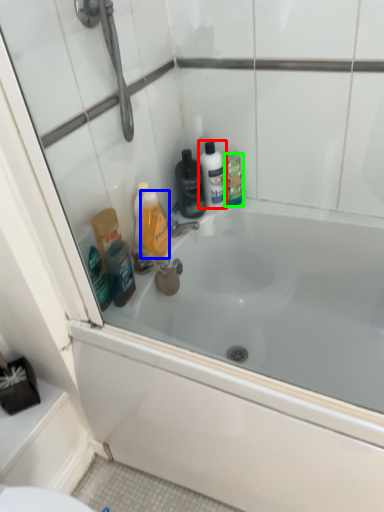
Question: Considering the real-world distances, which object is farthest from mouthwash (highlighted by a red box)? mouthwash (highlighted by a blue box) or mouthwash (highlighted by a green box)?

Choices:
 (A) mouthwash
 (B) mouthwash

Answer: (A)